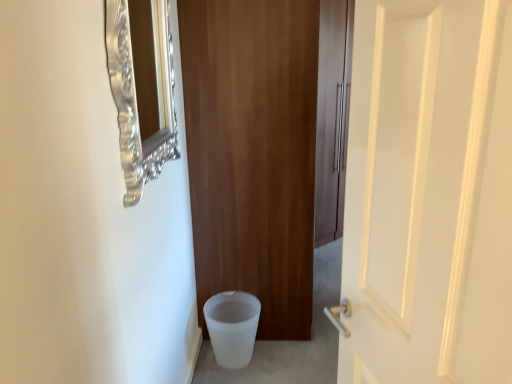
Question: Is white glossy door at right, the first door viewed from the front, taller or shorter than white frosted potty at lower left?

Choices:
 (A) short
 (B) tall

Answer: (B)

Question: Is white glossy door at right, the first door viewed from the front, wider or thinner than white frosted potty at lower left?

Choices:
 (A) wide
 (B) thin

Answer: (B)

Question: Which is nearer to the wooden door at center, the 2th door viewed from the front?

Choices:
 (A) white glossy door at right, the first door viewed from the front
 (B) silver ornate mirror at upper left
 (C) white frosted potty at lower left

Answer: (C)

Question: Which object is positioned farthest from the white frosted potty at lower left?

Choices:
 (A) white glossy door at right, the first door viewed from the front
 (B) silver ornate mirror at upper left
 (C) wooden door at center, the 2th door viewed from the front

Answer: (A)